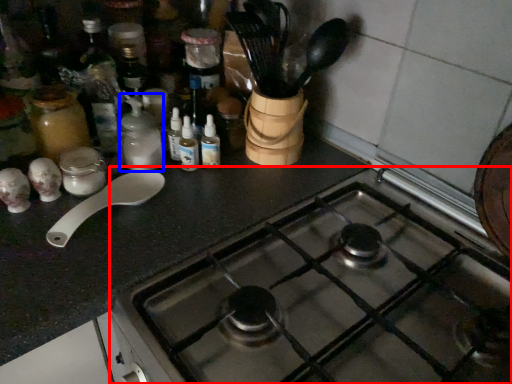
Question: Which object is further to the camera taking this photo, gas stove (highlighted by a red box) or bottle (highlighted by a blue box)?

Choices:
 (A) gas stove
 (B) bottle

Answer: (B)